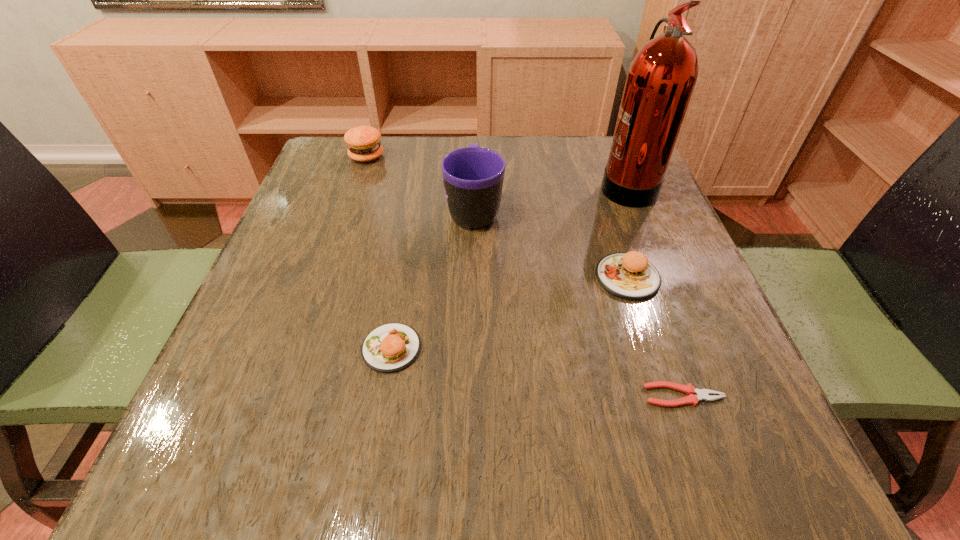
You are a GUI agent. You are given a task and a screenshot of the screen. Output one action in this format:
    pyautogui.click(x=<x>, y=<y>)
    Task: Click on the vacant space located on the left of the shortest object
    This screenshot has width=960, height=540.
    Given the screenshot: What is the action you would take?
    pyautogui.click(x=577, y=395)

The image size is (960, 540). What are the coordinates of `fire extinguisher situated at the far edge` in the screenshot? It's located at (660, 81).

Locate an element on the screen. This screenshot has height=540, width=960. mug at the far edge is located at coordinates (473, 176).

Locate an element on the screen. Image resolution: width=960 pixels, height=540 pixels. patty present at the far edge is located at coordinates (363, 142).

Locate an element on the screen. object that is at the left edge is located at coordinates (363, 142).

Find the location of `fire extinguisher that is positioned at the right edge`. fire extinguisher that is positioned at the right edge is located at coordinates (660, 81).

The height and width of the screenshot is (540, 960). In order to click on patty that is at the right edge in this screenshot , I will do point(630,275).

Locate an element on the screen. This screenshot has width=960, height=540. pliers that is positioned at the right edge is located at coordinates (701, 394).

Where is `object that is positioned at the far left corner`? This screenshot has height=540, width=960. object that is positioned at the far left corner is located at coordinates (363, 142).

The height and width of the screenshot is (540, 960). What are the coordinates of `object that is positioned at the far right corner` in the screenshot? It's located at point(660,81).